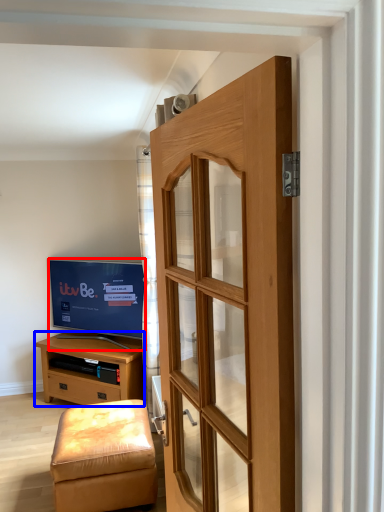
Question: Which of the following is the closest to the observer, television (highlighted by a red box) or chest of drawers (highlighted by a blue box)?

Choices:
 (A) television
 (B) chest of drawers

Answer: (B)